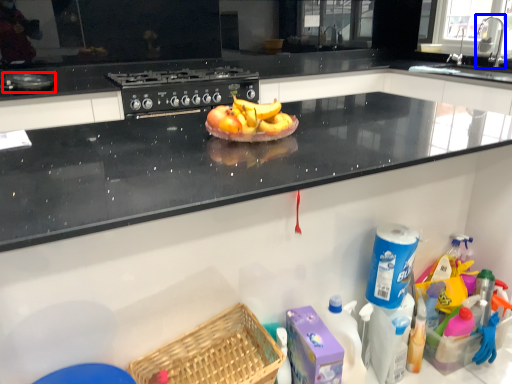
Question: Which object is closer to the camera taking this photo, appliance (highlighted by a red box) or faucet (highlighted by a blue box)?

Choices:
 (A) appliance
 (B) faucet

Answer: (A)